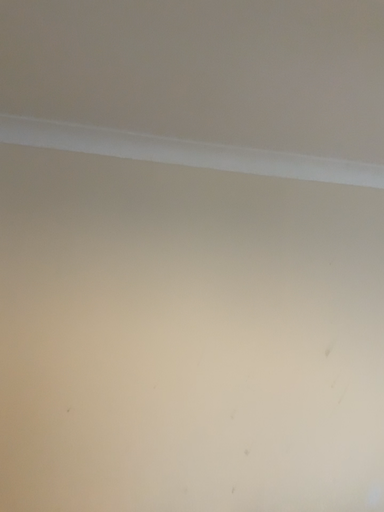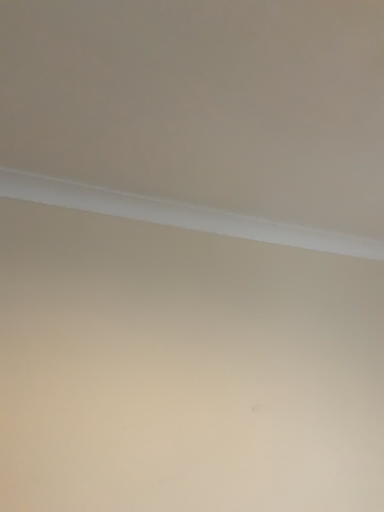
Question: Which way did the camera rotate in the video?

Choices:
 (A) rotated left
 (B) rotated right

Answer: (B)